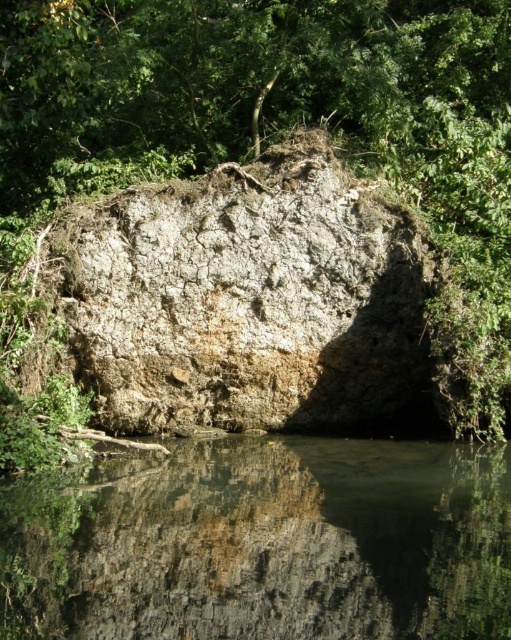
Is transparent water at center above gray rough rock at center?

Incorrect, transparent water at center is not positioned above gray rough rock at center.

Find the location of `transparent water at center`. transparent water at center is located at coordinates (267, 545).

Does point (28, 632) come in front of point (233, 227)?

Yes, it is.

At what (x,y) coordinates should I click in order to perform the action: click on transparent water at center. Please return your answer as a coordinate pair (x, y). This screenshot has height=640, width=511. Looking at the image, I should click on (267, 545).